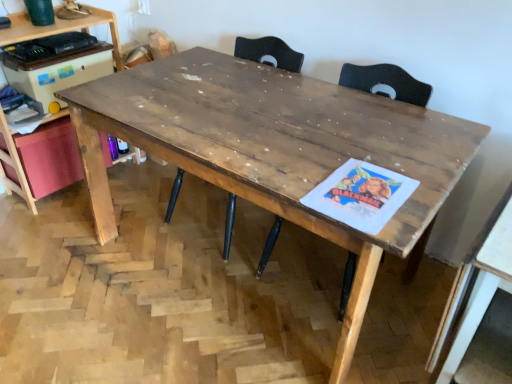
Question: Considering the positions of wooden table at right, which is the second table from left to right, and wooden computer desk at left in the image, is wooden table at right, which is the second table from left to right, taller or shorter than wooden computer desk at left?

Choices:
 (A) short
 (B) tall

Answer: (A)

Question: Is wooden table at right, which is the second table from left to right, spatially inside wooden computer desk at left, or outside of it?

Choices:
 (A) inside
 (B) outside

Answer: (B)

Question: Considering the real-world distances, which object is farthest from the wooden computer desk at left?

Choices:
 (A) wooden table at right, the 1th table when ordered from right to left
 (B) wooden table at center, placed as the second table when sorted from right to left
 (C) wooden swivel chair at center

Answer: (A)

Question: Estimate the real-world distances between objects in this image. Which object is closer to the wooden computer desk at left?

Choices:
 (A) wooden swivel chair at center
 (B) wooden table at center, placed as the 1th table when sorted from left to right
 (C) wooden table at right, the 1th table when ordered from right to left

Answer: (B)